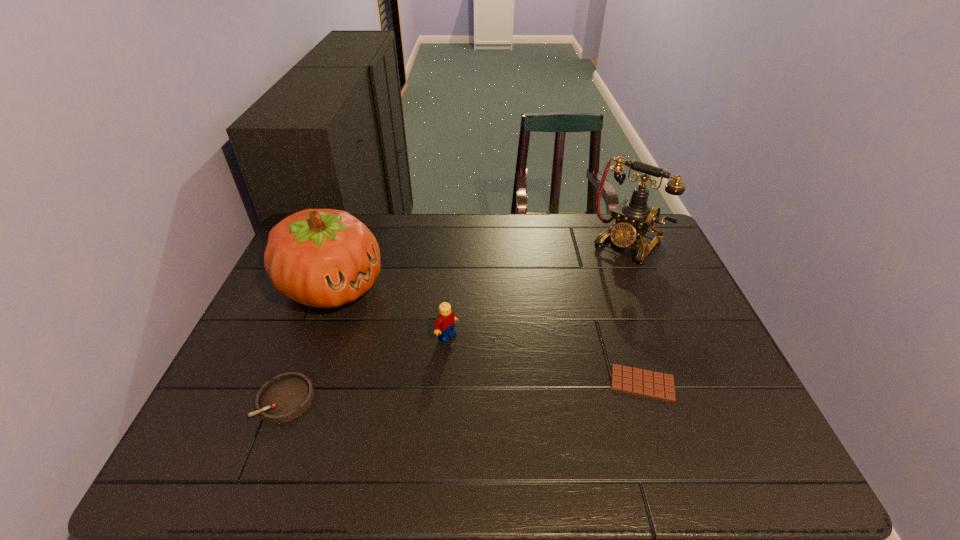
You are a GUI agent. You are given a task and a screenshot of the screen. Output one action in this format:
    pyautogui.click(x=<x>, y=<y>)
    Task: Click on the ashtray
    Image resolution: width=960 pixels, height=540 pixels.
    Given the screenshot: What is the action you would take?
    pyautogui.click(x=287, y=396)

Image resolution: width=960 pixels, height=540 pixels. Identify the location of the shortest object. (657, 385).

Where is `pumpkin`? Image resolution: width=960 pixels, height=540 pixels. pumpkin is located at coordinates (325, 258).

You are a GUI agent. You are given a task and a screenshot of the screen. Output one action in this format:
    pyautogui.click(x=<x>, y=<y>)
    Task: Click on the third object from right to left
    
    Given the screenshot: What is the action you would take?
    pyautogui.click(x=444, y=326)

This screenshot has width=960, height=540. Find the location of `the third farthest object`. the third farthest object is located at coordinates (444, 326).

Where is `telephone`? This screenshot has height=540, width=960. telephone is located at coordinates (634, 218).

At what (x,y) coordinates should I click in order to perform the action: click on vacant area situated on the back of the ashtray. Please return your answer as a coordinate pair (x, y). Looking at the image, I should click on [335, 273].

Where is `vacant space situated 0.380m on the left of the candy bar`? The height and width of the screenshot is (540, 960). vacant space situated 0.380m on the left of the candy bar is located at coordinates point(446,383).

Find the location of a particular element. free region located on the side of the pumpkin with the cute face is located at coordinates (411, 330).

Locate an element on the screen. The width and height of the screenshot is (960, 540). vacant area located 0.280m on the side of the pumpkin with the cute face is located at coordinates (450, 353).